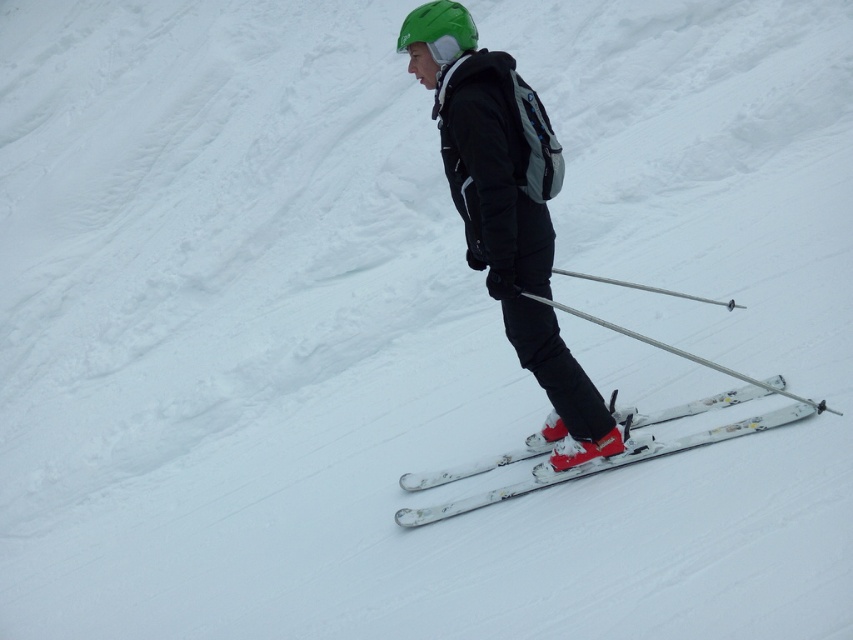
Question: Is matte black ski suit at center below silver metallic ski pole at center?

Choices:
 (A) yes
 (B) no

Answer: (B)

Question: Estimate the real-world distances between objects in this image. Which object is closer to the white matte skis at center?

Choices:
 (A) silver metallic ski pole at center
 (B) matte black ski suit at center

Answer: (A)

Question: Considering the real-world distances, which object is farthest from the white matte skis at center?

Choices:
 (A) silver metallic ski pole at center
 (B) matte black ski suit at center

Answer: (B)

Question: Does matte black ski suit at center come behind white matte skis at center?

Choices:
 (A) no
 (B) yes

Answer: (A)

Question: Which point is closer to the camera?

Choices:
 (A) white matte skis at center
 (B) matte black ski suit at center
 (C) silver metallic ski pole at center

Answer: (B)

Question: Considering the relative positions of matte black ski suit at center and silver metallic ski pole at center in the image provided, where is matte black ski suit at center located with respect to silver metallic ski pole at center?

Choices:
 (A) above
 (B) below

Answer: (A)